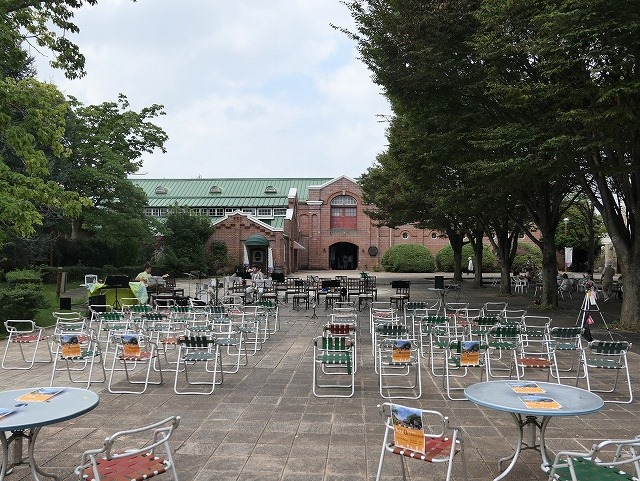
Where is `floor`? The image size is (640, 481). floor is located at coordinates (271, 395), (339, 268).